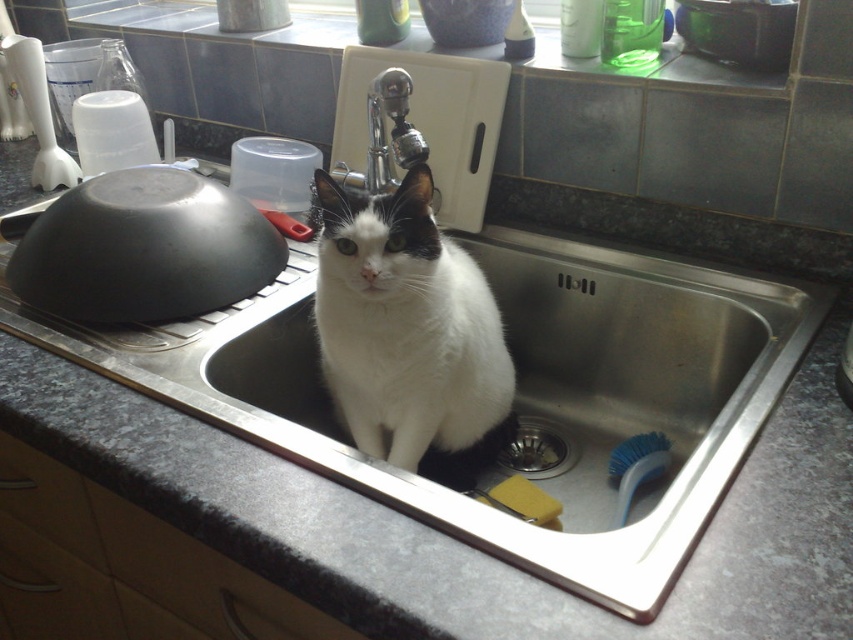
Question: Observing the image, what is the correct spatial positioning of matte black bowl at left in reference to brushed metal sink at lower center?

Choices:
 (A) below
 (B) above

Answer: (B)

Question: Which object is farther from the camera taking this photo?

Choices:
 (A) white fur cat at sink
 (B) brushed metal sink at lower center
 (C) polished chrome faucet at upper center

Answer: (B)

Question: Does white fur cat at sink have a lesser width compared to brushed metal sink at lower center?

Choices:
 (A) no
 (B) yes

Answer: (A)

Question: Which point appears farthest from the camera in this image?

Choices:
 (A) (401, 109)
 (B) (425, 380)
 (C) (97, 230)

Answer: (A)

Question: Which object is closer to the camera taking this photo?

Choices:
 (A) brushed metal sink at lower center
 (B) polished chrome faucet at upper center
 (C) matte black bowl at left

Answer: (C)

Question: Can you confirm if polished chrome faucet at upper center is positioned above brushed metal sink at lower center?

Choices:
 (A) yes
 (B) no

Answer: (A)